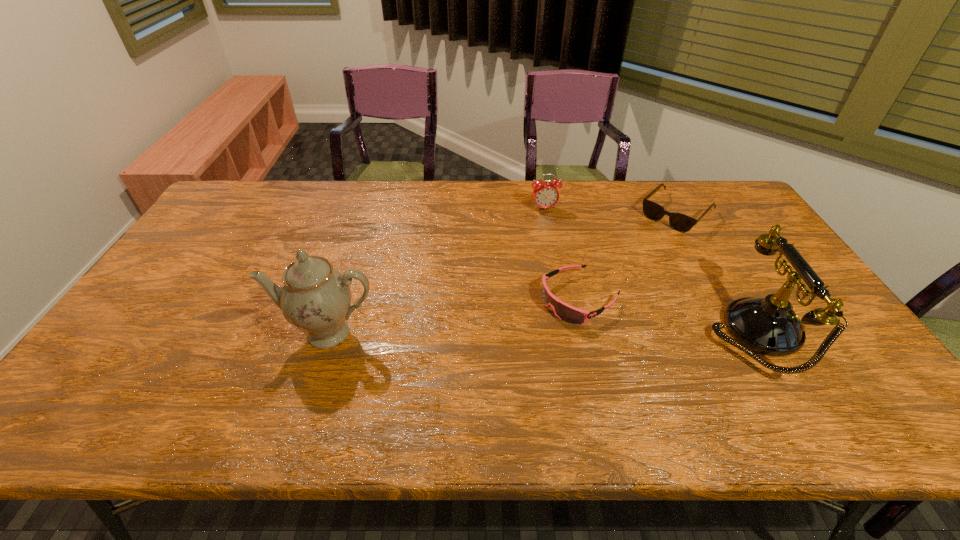
Identify the location of object that is the closest to the alarm clock. (680, 222).

Locate an element on the screen. The image size is (960, 540). vacant position in the image that satisfies the following two spatial constraints: 1. on the front side of the telephone; 2. on the dial of the third tallest object is located at coordinates (567, 333).

Identify the location of vacant area in the image that satisfies the following two spatial constraints: 1. on the back side of the sunglasses; 2. on the left side of the goggles. (560, 213).

Identify the location of free region that satisfies the following two spatial constraints: 1. on the front side of the telephone; 2. on the dial of the goggles. Image resolution: width=960 pixels, height=540 pixels. (588, 333).

Identify the location of free space that satisfies the following two spatial constraints: 1. on the front side of the fourth shortest object; 2. on the dial of the goggles. (588, 333).